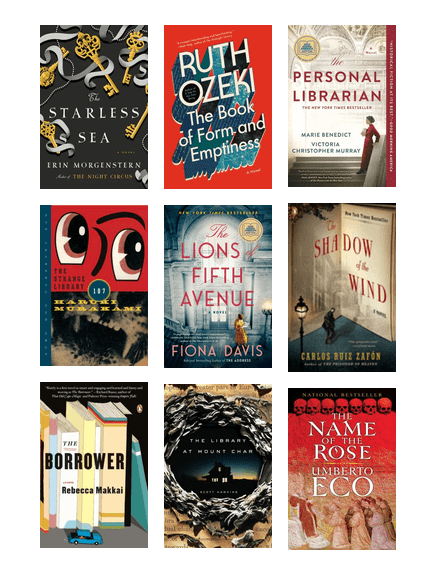
At what (x,y) coordinates should I click in order to perform the action: click on front cover of books. Please return your answer as a coordinate pair (x, y). Looking at the image, I should click on (97, 109), (223, 99), (340, 104), (340, 279), (217, 274), (104, 279), (99, 456), (213, 470), (336, 480).